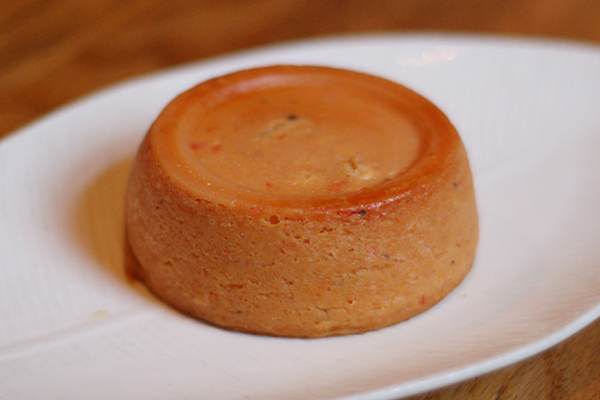
Where is `side of plate`? The height and width of the screenshot is (400, 600). side of plate is located at coordinates (211, 59).